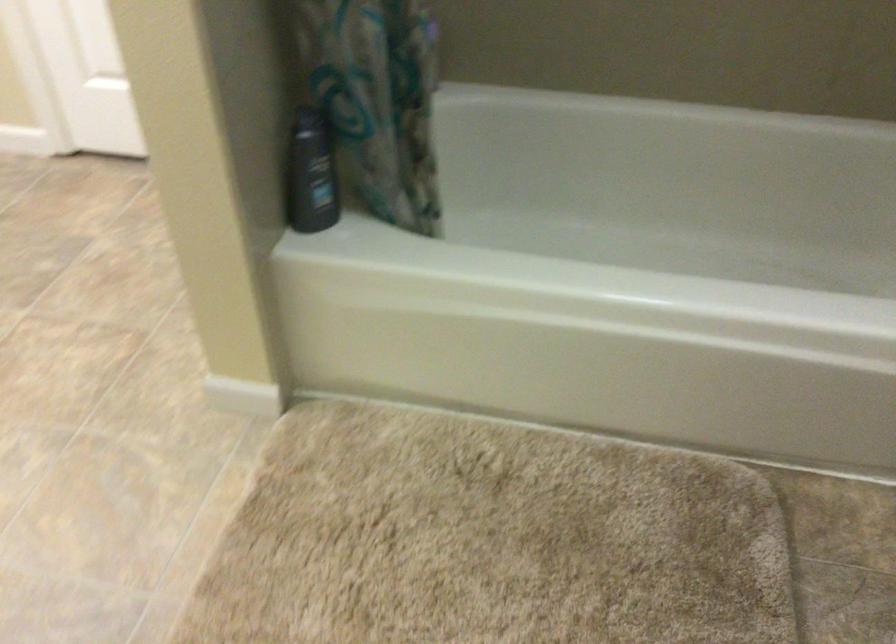
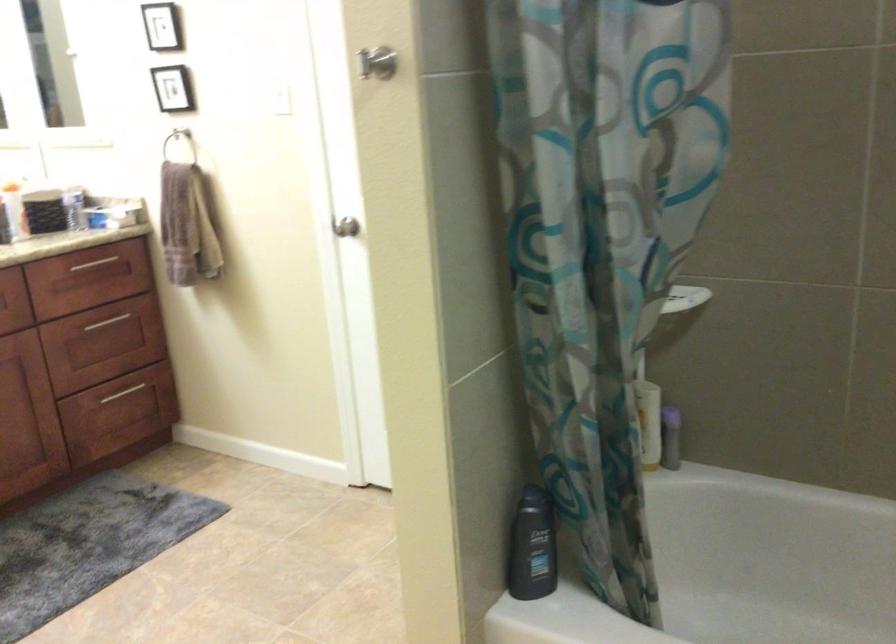
The point at (x=314, y=176) is marked in the first image. Where is the corresponding point in the second image?

(531, 547)